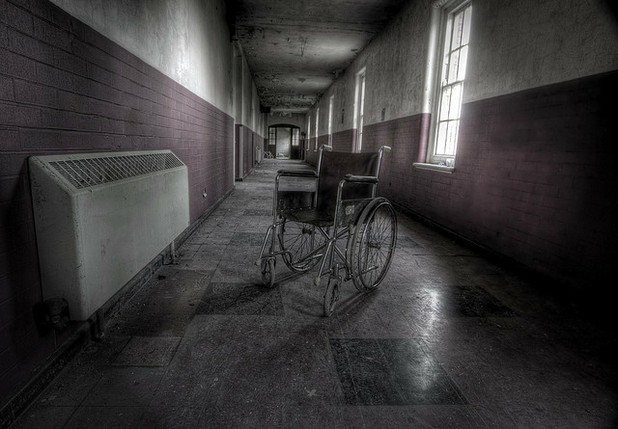
Where is `tile floor`? tile floor is located at coordinates (271, 350), (424, 283), (260, 181).